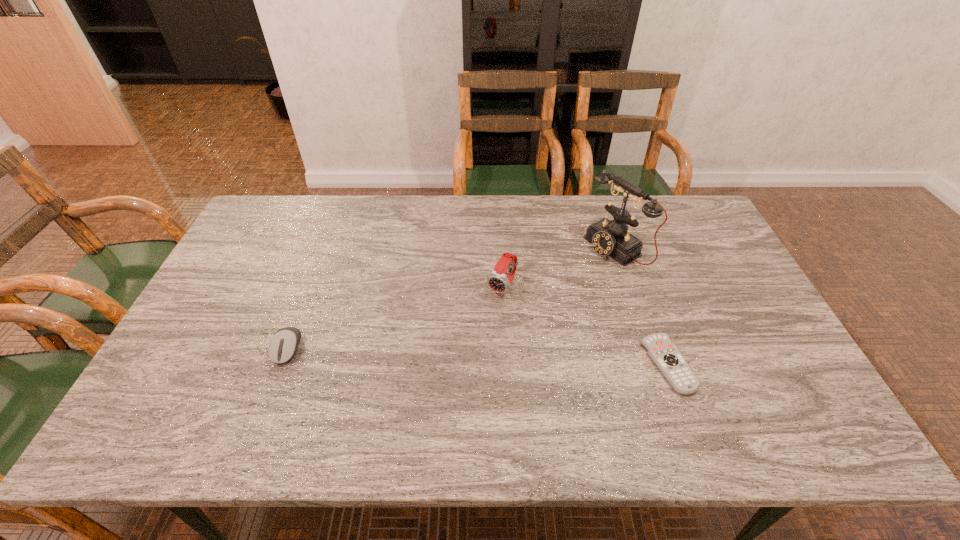
Find the location of a particular element. free space located on the face of the second tallest object is located at coordinates (443, 382).

The width and height of the screenshot is (960, 540). In order to click on blank space located on the dial of the tallest object in this screenshot , I will do `click(546, 293)`.

You are a GUI agent. You are given a task and a screenshot of the screen. Output one action in this format:
    pyautogui.click(x=<x>, y=<y>)
    Task: Click on the vacant region located on the dial of the tallest object
    
    Given the screenshot: What is the action you would take?
    pyautogui.click(x=554, y=288)

This screenshot has width=960, height=540. Find the location of `vacant space located on the dial of the tallest object`. vacant space located on the dial of the tallest object is located at coordinates (556, 287).

The image size is (960, 540). I want to click on object that is at the far edge, so click(x=612, y=238).

Find the location of a particular element. The width and height of the screenshot is (960, 540). object that is at the near edge is located at coordinates (666, 356).

The image size is (960, 540). In the image, there is a desktop. What are the coordinates of `free region at the far edge` in the screenshot? It's located at (469, 230).

At what (x,y) coordinates should I click in order to perform the action: click on blank area at the near edge. Please return your answer as a coordinate pair (x, y). Image resolution: width=960 pixels, height=540 pixels. Looking at the image, I should click on (692, 400).

Identify the location of vacant space at the left edge. The image size is (960, 540). (269, 241).

Locate an element on the screen. The width and height of the screenshot is (960, 540). free region at the right edge of the desktop is located at coordinates (718, 265).